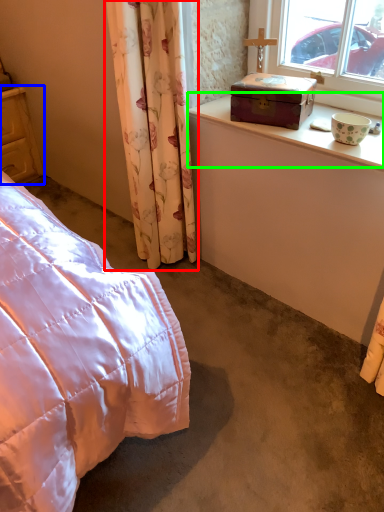
Question: Which object is the farthest from curtain (highlighted by a red box)? Choose among these: cupboard (highlighted by a blue box) or window sill (highlighted by a green box).

Choices:
 (A) cupboard
 (B) window sill

Answer: (A)